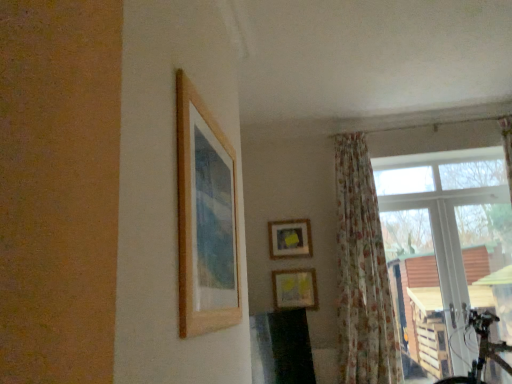
Question: Considering the relative sizes of wooden picture frame at upper left, the first picture frame in the front-to-back sequence, and floral fabric curtain at right in the image provided, is wooden picture frame at upper left, the first picture frame in the front-to-back sequence, taller than floral fabric curtain at right?

Choices:
 (A) no
 (B) yes

Answer: (A)

Question: Can you confirm if wooden picture frame at upper left, the first picture frame in the front-to-back sequence, is positioned to the left of floral fabric curtain at right?

Choices:
 (A) no
 (B) yes

Answer: (B)

Question: Is wooden picture frame at upper left, which is the 3th picture frame in back-to-front order, smaller than floral fabric curtain at right?

Choices:
 (A) yes
 (B) no

Answer: (A)

Question: Is wooden picture frame at upper left, positioned as the 3th picture frame in bottom-to-top order, behind floral fabric curtain at right?

Choices:
 (A) no
 (B) yes

Answer: (A)

Question: Is wooden picture frame at upper left, positioned as the 3th picture frame in bottom-to-top order, with floral fabric curtain at right?

Choices:
 (A) no
 (B) yes

Answer: (A)

Question: Looking at the image, does matte yellow picture frame at center, positioned as the 2th picture frame in top-to-bottom order, seem bigger or smaller compared to matte wooden picture frame at center, positioned as the 2th picture frame in front-to-back order?

Choices:
 (A) small
 (B) big

Answer: (A)

Question: From the image's perspective, is matte yellow picture frame at center, positioned as the 2th picture frame in top-to-bottom order, above or below matte wooden picture frame at center, positioned as the 2th picture frame in front-to-back order?

Choices:
 (A) below
 (B) above

Answer: (B)

Question: Does point (294, 253) appear closer or farther from the camera than point (297, 291)?

Choices:
 (A) farther
 (B) closer

Answer: (A)

Question: Based on their positions, is matte yellow picture frame at center, the third picture frame in the front-to-back sequence, located to the left or right of matte wooden picture frame at center, positioned as the 2th picture frame in front-to-back order?

Choices:
 (A) left
 (B) right

Answer: (A)

Question: Considering the positions of point (303, 276) and point (307, 233), is point (303, 276) closer or farther from the camera than point (307, 233)?

Choices:
 (A) closer
 (B) farther

Answer: (A)

Question: Is matte wooden picture frame at center, positioned as the 2th picture frame in front-to-back order, to the left or to the right of matte yellow picture frame at center, the third picture frame in the front-to-back sequence, in the image?

Choices:
 (A) left
 (B) right

Answer: (B)

Question: Do you think matte wooden picture frame at center, which is counted as the third picture frame, starting from the top, is within matte yellow picture frame at center, the third picture frame in the front-to-back sequence, or outside of it?

Choices:
 (A) inside
 (B) outside

Answer: (B)

Question: In the image, is matte wooden picture frame at center, positioned as the 2th picture frame in front-to-back order, positioned in front of or behind matte yellow picture frame at center, positioned as the 2th picture frame in top-to-bottom order?

Choices:
 (A) behind
 (B) front

Answer: (B)

Question: Considering the positions of matte yellow picture frame at center, the third picture frame in the front-to-back sequence, and transparent glass window at right in the image, is matte yellow picture frame at center, the third picture frame in the front-to-back sequence, taller or shorter than transparent glass window at right?

Choices:
 (A) short
 (B) tall

Answer: (A)

Question: Is matte yellow picture frame at center, which is counted as the 2th picture frame, starting from the bottom, in front of or behind transparent glass window at right in the image?

Choices:
 (A) front
 (B) behind

Answer: (B)